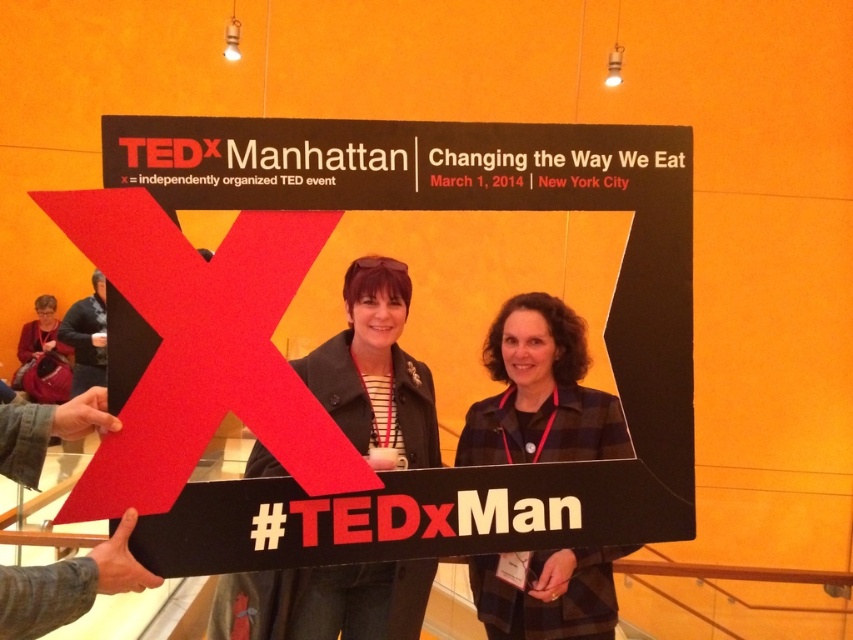
Question: Which point is closer to the camera taking this photo?

Choices:
 (A) (415, 592)
 (B) (94, 308)
 (C) (68, 392)
 (D) (567, 317)

Answer: (A)

Question: Can you confirm if plaid fabric jacket at center is smaller than matte black jacket at lower left?

Choices:
 (A) yes
 (B) no

Answer: (A)

Question: Among these objects, which one is nearest to the camera?

Choices:
 (A) matte black jacket at center
 (B) plaid fabric jacket at center
 (C) dark gray sweater at left
 (D) matte black jacket at lower left

Answer: (B)

Question: From the image, what is the correct spatial relationship of matte black jacket at lower left in relation to dark gray sweater at left?

Choices:
 (A) above
 (B) below

Answer: (B)

Question: Which point is farther to the camera?

Choices:
 (A) matte black jacket at lower left
 (B) dark gray sweater at left

Answer: (A)

Question: Does plaid fabric jacket at center have a larger size compared to dark gray sweater at left?

Choices:
 (A) no
 (B) yes

Answer: (A)